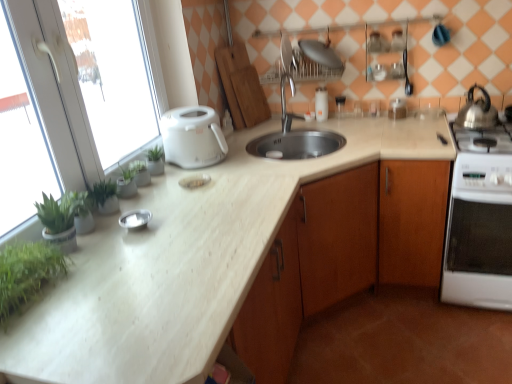
What is the approximate width of wooden cabinet at right?

The width of wooden cabinet at right is 66.28 centimeters.

Find the location of `green leafy plant at left`. green leafy plant at left is located at coordinates (56, 91).

Describe the element at coordinates (192, 137) in the screenshot. I see `white plastic toaster at left, the second kitchen appliance in the right-to-left sequence` at that location.

Measure the distance between point (490,115) and camera.

A distance of 7.12 feet exists between point (490,115) and camera.

Describe the element at coordinates (27, 272) in the screenshot. I see `green leafy plant at left` at that location.

At what (x,y) coordinates should I click in order to perform the action: click on white marble countertop at center. Please return your answer as a coordinate pair (x, y). The width and height of the screenshot is (512, 384). Looking at the image, I should click on (186, 263).

Where is `silver metallic faucet at center`? silver metallic faucet at center is located at coordinates (285, 103).

From the image's perspective, does metallic silver plate at upper center, the 4th appliance ordered from the bottom, appear higher than silver metallic bowl at center, which is the first appliance from left to right?

Indeed, from the image's perspective, metallic silver plate at upper center, the 4th appliance ordered from the bottom, is shown above silver metallic bowl at center, which is the first appliance from left to right.

In the scene shown: From a real-world perspective, is metallic silver plate at upper center, the second appliance viewed from the front, on silver metallic bowl at center, which is the 1th appliance from front to back?

Indeed, from a real-world perspective, metallic silver plate at upper center, the second appliance viewed from the front, stands above silver metallic bowl at center, which is the 1th appliance from front to back.

Is metallic silver plate at upper center, which is the first appliance from top to bottom, aimed at silver metallic bowl at center, which is the first appliance from left to right?

Yes, metallic silver plate at upper center, which is the first appliance from top to bottom, faces towards silver metallic bowl at center, which is the first appliance from left to right.

Considering the positions of points (282, 81) and (214, 125), is point (282, 81) closer to camera compared to point (214, 125)?

No, (282, 81) is further to viewer.

Is silver metallic faucet at center behind white plastic toaster at left, the second kitchen appliance in the right-to-left sequence?

Yes, it is behind white plastic toaster at left, the second kitchen appliance in the right-to-left sequence.

Based on the photo, between silver metallic faucet at center and white plastic toaster at left, the second kitchen appliance in the right-to-left sequence, which one has larger width?

With larger width is white plastic toaster at left, the second kitchen appliance in the right-to-left sequence.

From the image's perspective, is silver metallic faucet at center above or below white plastic toaster at left, the second kitchen appliance in the right-to-left sequence?

Based on their image positions, silver metallic faucet at center is located above white plastic toaster at left, the second kitchen appliance in the right-to-left sequence.

Is wooden cabinet at right facing towards white glossy salt shaker at upper center, which ranks as the first appliance in back-to-front order?

No, wooden cabinet at right is not turned towards white glossy salt shaker at upper center, which ranks as the first appliance in back-to-front order.

Considering the relative positions of wooden cabinet at right and white glossy salt shaker at upper center, which ranks as the first appliance in back-to-front order, in the image provided, is wooden cabinet at right to the right of white glossy salt shaker at upper center, which ranks as the first appliance in back-to-front order, from the viewer's perspective?

Correct, you'll find wooden cabinet at right to the right of white glossy salt shaker at upper center, which ranks as the first appliance in back-to-front order.

In the scene shown: What's the angular difference between wooden cabinet at right and white glossy salt shaker at upper center, the 4th appliance positioned from the front,'s facing directions?

There is a 0.0077-degree angle between the facing directions of wooden cabinet at right and white glossy salt shaker at upper center, the 4th appliance positioned from the front.

Which is behind, point (379, 199) or point (321, 119)?

The point (321, 119) is behind.

Is point (461, 110) positioned before point (321, 92)?

Yes, it is.

Could you measure the distance between shiny metallic kettle at upper right, the first kitchen appliance viewed from the right, and white glossy salt shaker at upper center, the second appliance in the top-to-bottom sequence?

shiny metallic kettle at upper right, the first kitchen appliance viewed from the right, is 30.06 inches away from white glossy salt shaker at upper center, the second appliance in the top-to-bottom sequence.

Considering the relative sizes of shiny metallic kettle at upper right, which is the 2th kitchen appliance from left to right, and white glossy salt shaker at upper center, which is counted as the 3th appliance, starting from the left, in the image provided, is shiny metallic kettle at upper right, which is the 2th kitchen appliance from left to right, smaller than white glossy salt shaker at upper center, which is counted as the 3th appliance, starting from the left,?

Incorrect, shiny metallic kettle at upper right, which is the 2th kitchen appliance from left to right, is not smaller in size than white glossy salt shaker at upper center, which is counted as the 3th appliance, starting from the left.

Can you confirm if shiny metallic kettle at upper right, which is the 2th kitchen appliance from left to right, is thinner than white glossy salt shaker at upper center, the second appliance when ordered from right to left?

No.

Measure the distance between wooden cabinet at right and clear glass jar at upper right, which ranks as the second appliance in bottom-to-top order.

wooden cabinet at right is 23.41 inches from clear glass jar at upper right, which ranks as the second appliance in bottom-to-top order.

Is wooden cabinet at right facing away from clear glass jar at upper right, which ranks as the second appliance in bottom-to-top order?

No.

Between wooden cabinet at right and clear glass jar at upper right, the third appliance from the front, which one has more height?

Standing taller between the two is wooden cabinet at right.

Between wooden cabinet at right and clear glass jar at upper right, the 3th appliance in the top-to-bottom sequence, which one has smaller size?

clear glass jar at upper right, the 3th appliance in the top-to-bottom sequence.

Relative to silver metallic bowl at center, the 1th appliance ordered from the bottom, is white glossy salt shaker at upper center, which ranks as the first appliance in back-to-front order, in front or behind?

In the image, white glossy salt shaker at upper center, which ranks as the first appliance in back-to-front order, appears behind silver metallic bowl at center, the 1th appliance ordered from the bottom.

From the image's perspective, is white glossy salt shaker at upper center, the second appliance when ordered from right to left, above silver metallic bowl at center, the 1th appliance ordered from the bottom?

Yes.

Is silver metallic bowl at center, which ranks as the fourth appliance in back-to-front order, a part of white glossy salt shaker at upper center, the second appliance in the top-to-bottom sequence?

No, silver metallic bowl at center, which ranks as the fourth appliance in back-to-front order, is not surrounded by white glossy salt shaker at upper center, the second appliance in the top-to-bottom sequence.

Is white glossy salt shaker at upper center, which is counted as the 3th appliance, starting from the left, far from silver metallic bowl at center, which is the first appliance from left to right?

Yes, white glossy salt shaker at upper center, which is counted as the 3th appliance, starting from the left, and silver metallic bowl at center, which is the first appliance from left to right, are located far from each other.

Does green leafy plant at left have a lesser width compared to white plastic toaster at left, the 1th kitchen appliance in the left-to-right sequence?

Correct, the width of green leafy plant at left is less than that of white plastic toaster at left, the 1th kitchen appliance in the left-to-right sequence.

Is white plastic toaster at left, the 1th kitchen appliance in the left-to-right sequence, inside green leafy plant at left?

No, white plastic toaster at left, the 1th kitchen appliance in the left-to-right sequence, is not a part of green leafy plant at left.

You are a GUI agent. You are given a task and a screenshot of the screen. Output one action in this format:
    pyautogui.click(x=<x>, y=<y>)
    Task: Click on the window screen that appears above the white plastic toaster at left, the second kitchen appliance in the right-to-left sequence (from the image's perspective)
    The height and width of the screenshot is (384, 512).
    Given the screenshot: What is the action you would take?
    pyautogui.click(x=56, y=91)

Is green leafy plant at left positioned with its back to white plastic toaster at left, the second kitchen appliance in the right-to-left sequence?

That's right, green leafy plant at left is facing away from white plastic toaster at left, the second kitchen appliance in the right-to-left sequence.

The image size is (512, 384). I want to click on appliance that is the 3rd one below the metallic silver plate at upper center, the second appliance viewed from the front (from a real-world perspective), so click(x=135, y=219).

Identify the location of tap above the white plastic toaster at left, the 1th kitchen appliance in the left-to-right sequence (from the image's perspective). (285, 103).

From the image, which object appears to be farther from white glossy oven at right, clear glass jars at upper center or shiny metallic kettle at upper right, which is the 2th kitchen appliance from left to right?

Based on the image, clear glass jars at upper center appears to be further to white glossy oven at right.

Estimate the real-world distances between objects in this image. Which object is further from green leafy plant at left, metallic silver plate at upper center, marked as the 3th appliance in a right-to-left arrangement, or green leafy plant at left?

metallic silver plate at upper center, marked as the 3th appliance in a right-to-left arrangement, is positioned further to the anchor green leafy plant at left.

Looking at the image, which one is located closer to white glossy salt shaker at upper center, which is counted as the 3th appliance, starting from the left, silver metallic faucet at center or green leafy plant at left?

The object closer to white glossy salt shaker at upper center, which is counted as the 3th appliance, starting from the left, is silver metallic faucet at center.

Looking at the image, which one is located closer to white glossy oven at right, white marble countertop at center or white glossy salt shaker at upper center, which ranks as the first appliance in back-to-front order?

white marble countertop at center.

Looking at the image, which one is located further to wooden cabinet at right, green leafy plant at left or white glossy salt shaker at upper center, the second appliance when ordered from right to left?

green leafy plant at left is positioned further to the anchor wooden cabinet at right.

Which object lies further to the anchor point metallic silver plate at upper center, marked as the 3th appliance in a right-to-left arrangement, silver metallic faucet at center or silver metallic bowl at center, which is the 1th appliance from front to back?

silver metallic bowl at center, which is the 1th appliance from front to back, lies further to metallic silver plate at upper center, marked as the 3th appliance in a right-to-left arrangement, than the other object.

Which object lies nearer to the anchor point silver metallic faucet at center, silver metallic bowl at center, which appears as the fourth appliance when viewed from the top, or clear glass jar at upper right, the third appliance from the front?

clear glass jar at upper right, the third appliance from the front, is closer to silver metallic faucet at center.

From the image, which object appears to be nearer to clear glass jar at upper right, which is the second appliance from back to front, silver metallic faucet at center or white glossy oven at right?

silver metallic faucet at center is closer to clear glass jar at upper right, which is the second appliance from back to front.

You are a GUI agent. You are given a task and a screenshot of the screen. Output one action in this format:
    pyautogui.click(x=<x>, y=<y>)
    Task: Click on the shelf between metallic silver plate at upper center, acting as the 3th appliance starting from the back, and clear glass jar at upper right, the 3th appliance in the top-to-bottom sequence, from left to right
    The height and width of the screenshot is (384, 512).
    Given the screenshot: What is the action you would take?
    pyautogui.click(x=385, y=53)

I want to click on shelf between green leafy plant at left and white glossy oven at right in the horizontal direction, so click(x=385, y=53).

The height and width of the screenshot is (384, 512). I want to click on home appliance between white marble countertop at center and clear glass jar at upper right, which is the 4th appliance in left-to-right order, from front to back, so (480, 221).

Image resolution: width=512 pixels, height=384 pixels. Find the location of `shelf between metallic silver plate at upper center, which ranks as the second appliance in left-to-right order, and shiny metallic kettle at upper right, which is the 2th kitchen appliance from left to right, from left to right`. shelf between metallic silver plate at upper center, which ranks as the second appliance in left-to-right order, and shiny metallic kettle at upper right, which is the 2th kitchen appliance from left to right, from left to right is located at coordinates [x=385, y=53].